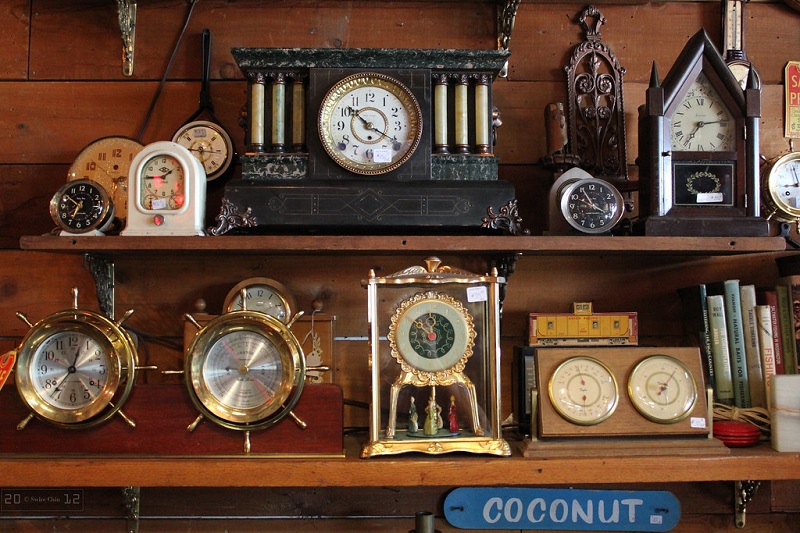
Where is `clocks in front row on bottom shelf`? clocks in front row on bottom shelf is located at coordinates (74, 379), (238, 369), (438, 342), (566, 393), (658, 389).